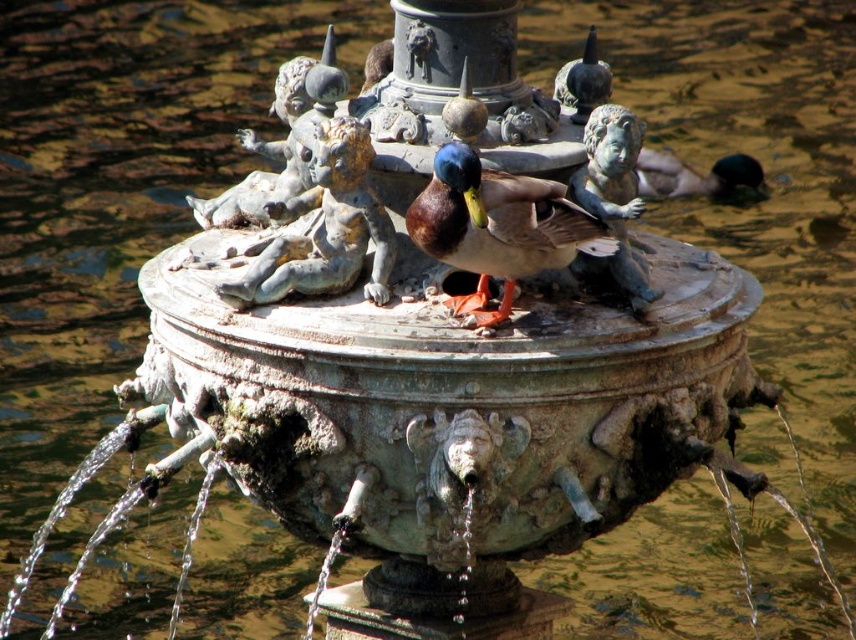
You are a photographer standing at the edge of the fountain. You want to capture a closeup shot of the shiny brown duck at center and the bronze cherub at center in the same frame. If your camera has a 50mm lens, which has a maximum focusing distance of 30 inches, will you be able to focus on both subjects simultaneously?

The shiny brown duck at center is 34.19 inches away from the bronze cherub at center. Since the maximum focusing distance of the 50mm lens is 30 inches, the distance between the two subjects exceeds this limit. Therefore, the camera cannot focus on both the shiny brown duck at center and the bronze cherub at center simultaneously.